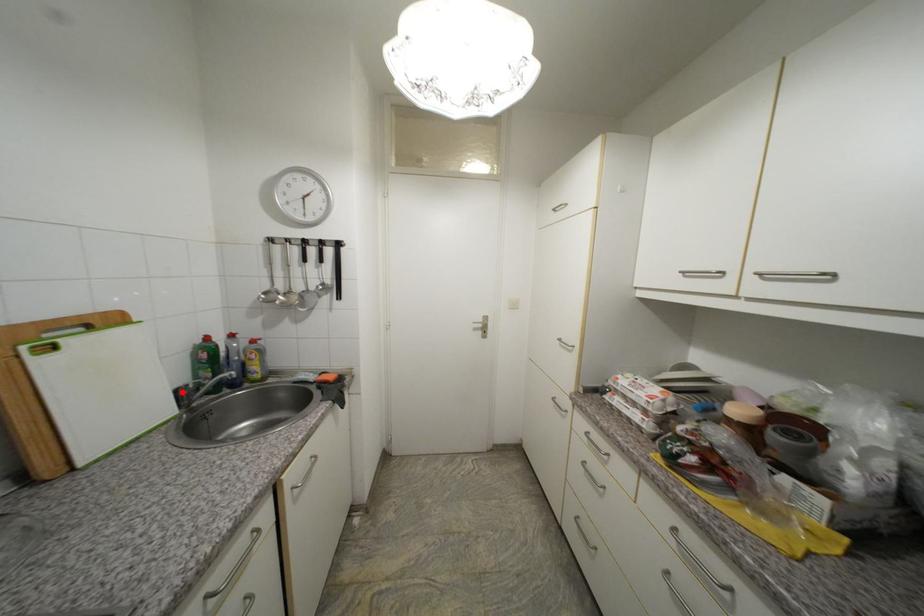
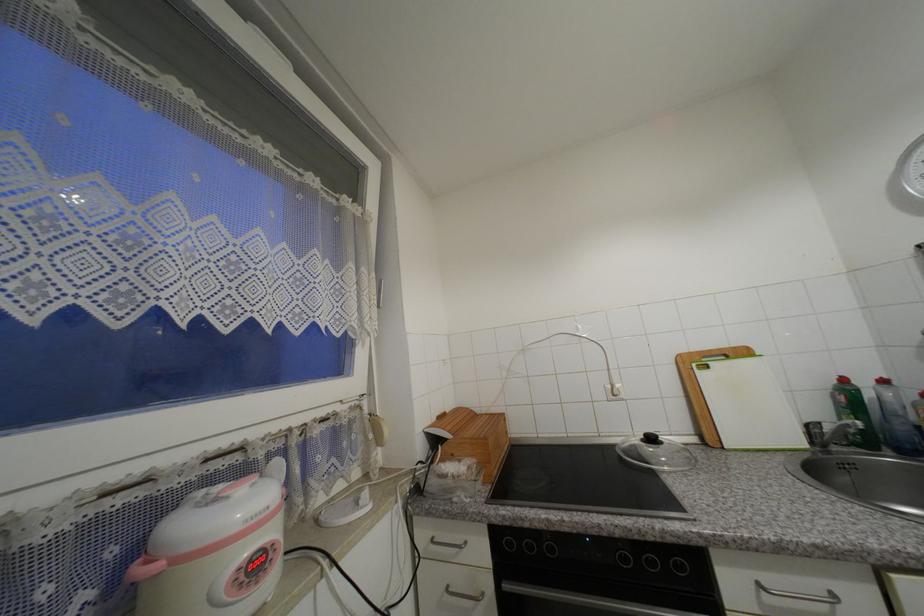
Question: I am providing you with two images of the same scene from different viewpoints. A red point is marked on the first image. Can you still see the location of the red point in image 2?

Choices:
 (A) Yes
 (B) No

Answer: (A)